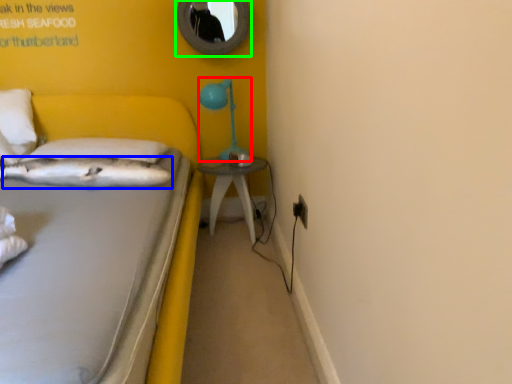
Question: Which is farther away from table lamp (highlighted by a red box)? pillow (highlighted by a blue box) or mirror (highlighted by a green box)?

Choices:
 (A) pillow
 (B) mirror

Answer: (A)